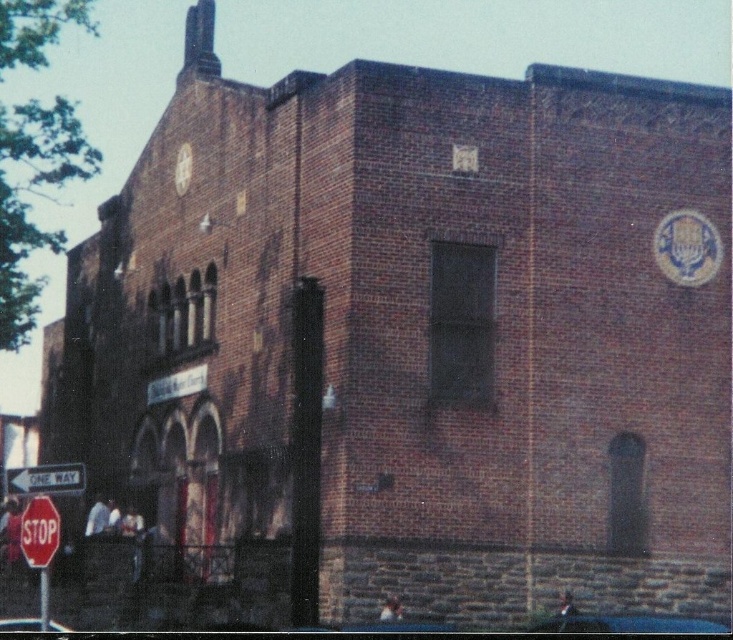
You are standing in front of St. John Church and want to take a photo. You notice two points marked on the building. The first point is at coordinate point (51, 532) and the second is at point (21, 474). If you want to focus on the point that is closer to you, which coordinate should you aim your camera at?

You should aim your camera at point (51, 532) because it is closer to you than point (21, 474).

You are driving a car and need to know which sign is narrower between the red glossy stop sign at lower left and the white plastic one way sign at lower left. Which one is narrower?

The red glossy stop sign at lower left is narrower than the white plastic one way sign at lower left.